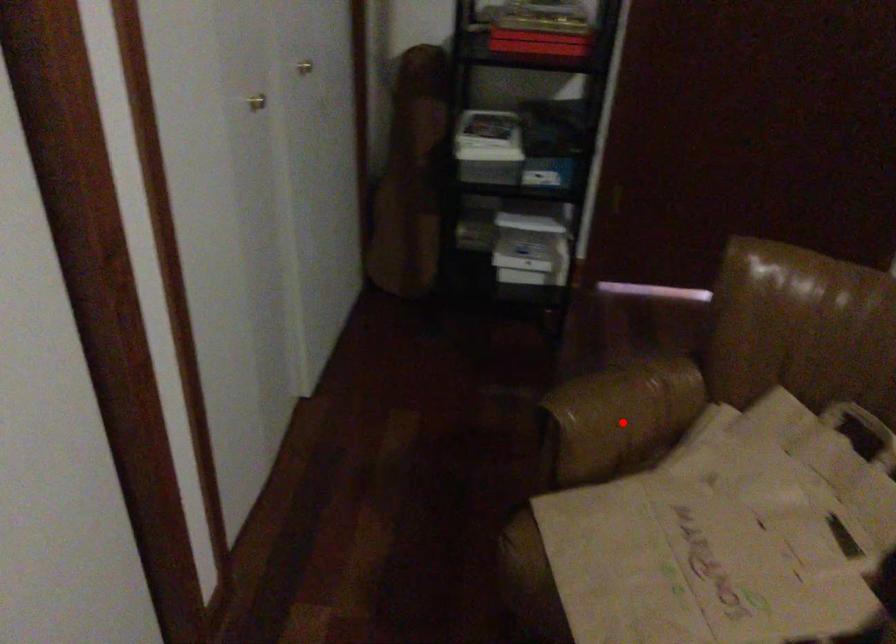
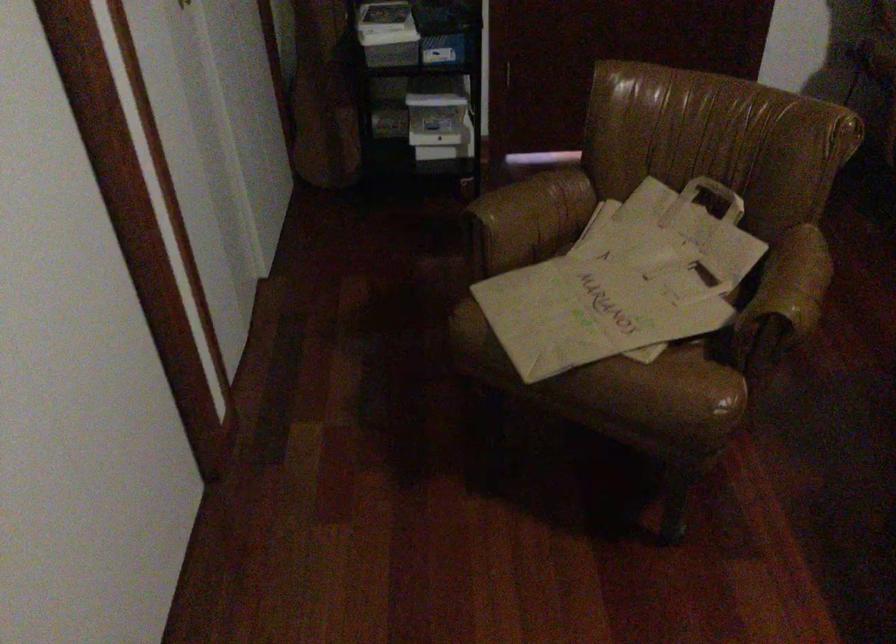
Question: I am providing you with two images of the same scene from different viewpoints. In image1, a red point is highlighted. Considering the same 3D point in image2, which of the following is correct?

Choices:
 (A) It is closer
 (B) It is farther

Answer: (B)